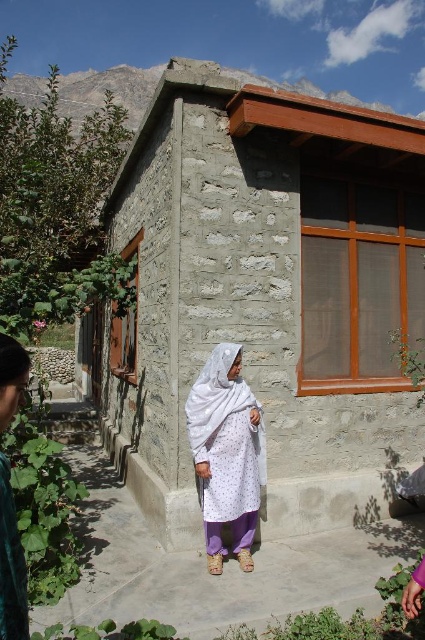
Question: Which point is farther from the camera taking this photo?

Choices:
 (A) (207, 88)
 (B) (220, 557)
 (C) (6, 403)

Answer: (A)

Question: Which point is closer to the camera?

Choices:
 (A) stone textured hut at center
 (B) white sheer fabric at center

Answer: (B)

Question: Among these objects, which one is farthest from the camera?

Choices:
 (A) white textured dress at center
 (B) stone textured hut at center
 (C) white sheer fabric at center

Answer: (B)

Question: Can you confirm if stone textured hut at center is thinner than white textured dress at center?

Choices:
 (A) no
 (B) yes

Answer: (A)

Question: Can you confirm if stone textured hut at center is wider than white sheer fabric at center?

Choices:
 (A) no
 (B) yes

Answer: (B)

Question: Observing the image, what is the correct spatial positioning of stone textured hut at center in reference to white sheer fabric at center?

Choices:
 (A) right
 (B) left

Answer: (B)